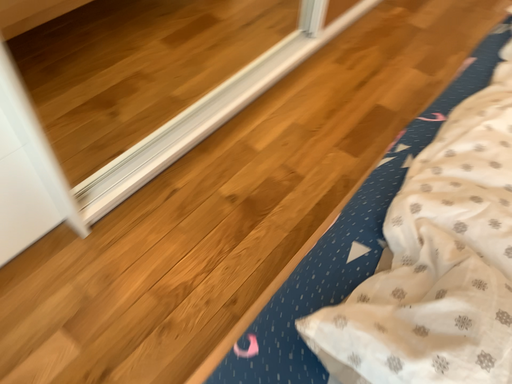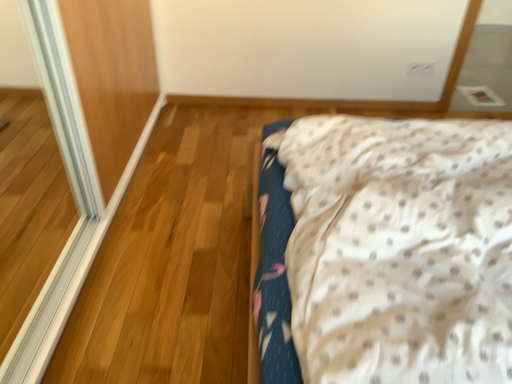
Question: Which way did the camera rotate in the video?

Choices:
 (A) rotated left
 (B) rotated right

Answer: (B)